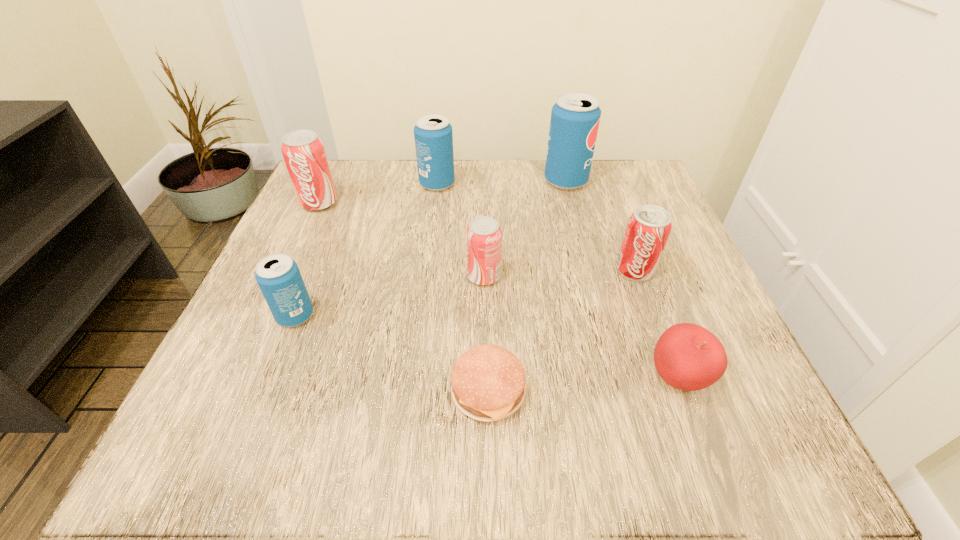
Locate an element on the screen. The height and width of the screenshot is (540, 960). blue soda can that is the second closest to the second biggest blue soda can is located at coordinates (279, 279).

At what (x,y) coordinates should I click in order to perform the action: click on blue soda can that is the closest to the red apple. Please return your answer as a coordinate pair (x, y). This screenshot has height=540, width=960. Looking at the image, I should click on [575, 117].

Identify which red soda can is the nearest to the third nearest object. Please provide its 2D coordinates. Your answer should be formatted as a tuple, i.e. [(x, y)], where the tuple contains the x and y coordinates of a point satisfying the conditions above.

[(483, 235)]

The height and width of the screenshot is (540, 960). In order to click on red soda can that stands as the third closest to the second biggest blue soda can in this screenshot , I will do `click(648, 228)`.

Locate an element on the screen. The height and width of the screenshot is (540, 960). vacant area in the image that satisfies the following two spatial constraints: 1. on the back side of the red apple; 2. on the logo side of the fourth soda can from left to right is located at coordinates (639, 276).

Locate an element on the screen. The height and width of the screenshot is (540, 960). vacant region that satisfies the following two spatial constraints: 1. on the logo side of the second red soda can from left to right; 2. on the left side of the seventh tallest object is located at coordinates (485, 379).

Image resolution: width=960 pixels, height=540 pixels. Find the location of `vacant region that satisfies the following two spatial constraints: 1. on the logo side of the farthest red soda can; 2. on the right side of the leftmost blue soda can`. vacant region that satisfies the following two spatial constraints: 1. on the logo side of the farthest red soda can; 2. on the right side of the leftmost blue soda can is located at coordinates (268, 316).